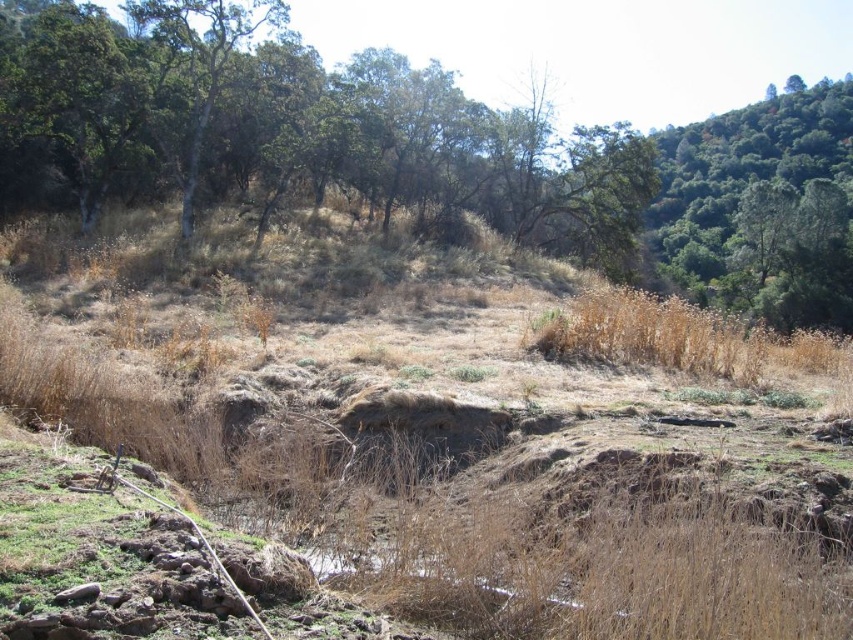
Between point (372, 387) and point (785, 232), which one is positioned behind?

The point (785, 232) is behind.

Which is in front, point (181, 310) or point (819, 124)?

Positioned in front is point (181, 310).

I want to click on brown grassy hillside at center, so click(404, 476).